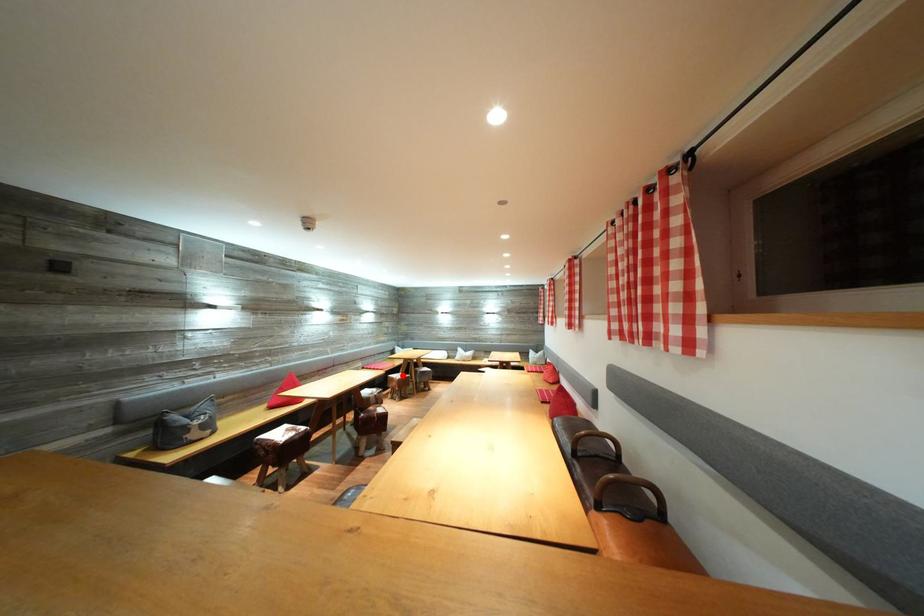
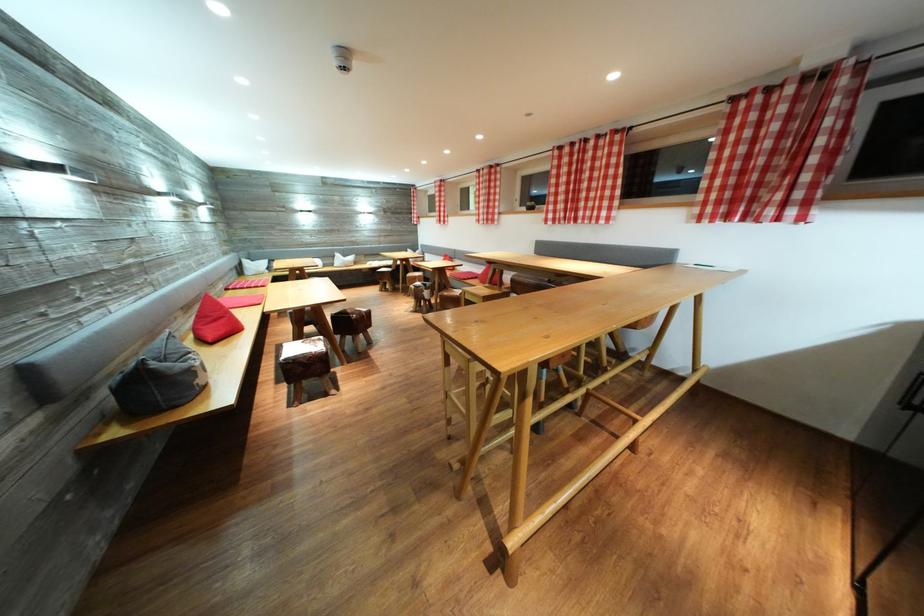
Question: I am providing you with two images of the same scene from different viewpoints. A red point is marked on the first image. At the location where the point appears in image 1, is it still visible in image 2?

Choices:
 (A) Yes
 (B) No

Answer: (B)